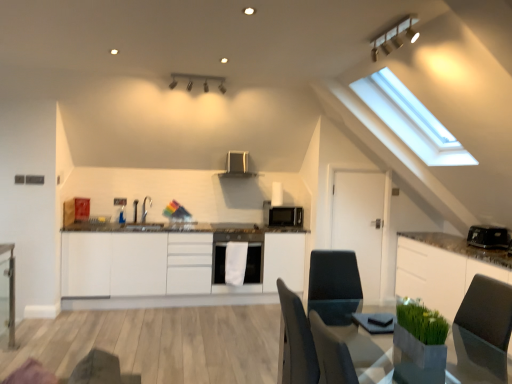
Question: Is white matte door at center to the left of white glossy cabinet at right, which is the 1th cabinetry from right to left, from the viewer's perspective?

Choices:
 (A) yes
 (B) no

Answer: (A)

Question: Is white matte door at center wider than white glossy cabinet at right, marked as the second cabinetry in a left-to-right arrangement?

Choices:
 (A) yes
 (B) no

Answer: (B)

Question: From the image's perspective, is white matte door at center below white glossy cabinet at right, which is the 1th cabinetry from right to left?

Choices:
 (A) no
 (B) yes

Answer: (A)

Question: From a real-world perspective, is white matte door at center located higher than white glossy cabinet at right, which is the 1th cabinetry from right to left?

Choices:
 (A) no
 (B) yes

Answer: (B)

Question: Is there a large distance between white matte door at center and white glossy cabinet at right, which is the 1th cabinetry from right to left?

Choices:
 (A) no
 (B) yes

Answer: (A)

Question: Is white matte door at center to the right of white glossy cabinet at right, which is the 1th cabinetry from right to left, from the viewer's perspective?

Choices:
 (A) yes
 (B) no

Answer: (B)

Question: From the image's perspective, is white matte cabinetry at center, acting as the 2th cabinetry starting from the right, above white glossy cabinet at right, marked as the second cabinetry in a left-to-right arrangement?

Choices:
 (A) no
 (B) yes

Answer: (B)

Question: Can white glossy cabinet at right, marked as the second cabinetry in a left-to-right arrangement, be found inside white matte cabinetry at center, which is counted as the first cabinetry, starting from the left?

Choices:
 (A) yes
 (B) no

Answer: (B)

Question: From the image's perspective, does white matte cabinetry at center, which is counted as the first cabinetry, starting from the left, appear lower than white glossy cabinet at right, marked as the second cabinetry in a left-to-right arrangement?

Choices:
 (A) yes
 (B) no

Answer: (B)

Question: Would you say white matte cabinetry at center, acting as the 2th cabinetry starting from the right, is a long distance from white glossy cabinet at right, marked as the second cabinetry in a left-to-right arrangement?

Choices:
 (A) no
 (B) yes

Answer: (B)

Question: From a real-world perspective, is white matte cabinetry at center, acting as the 2th cabinetry starting from the right, on white glossy cabinet at right, which is the 1th cabinetry from right to left?

Choices:
 (A) yes
 (B) no

Answer: (B)

Question: Is white matte cabinetry at center, acting as the 2th cabinetry starting from the right, further to the viewer compared to white glossy cabinet at right, which is the 1th cabinetry from right to left?

Choices:
 (A) yes
 (B) no

Answer: (A)

Question: Are white matte cabinetry at center, which is counted as the first cabinetry, starting from the left, and matte silver light fixture at upper center, arranged as the first light fixture when viewed from the right, located far from each other?

Choices:
 (A) yes
 (B) no

Answer: (A)